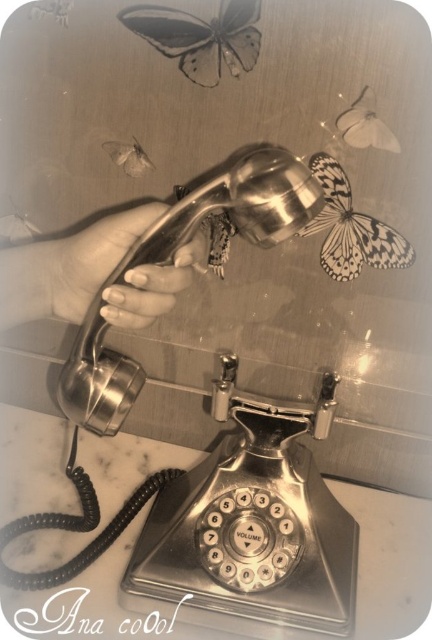
You are an artist trying to paint the scene. You want to ensure the butterflies are positioned correctly. Which butterfly, the white matte butterfly at upper right or the white paper butterfly at upper left, should you paint in front of the other?

The white matte butterfly at upper right should be painted in front of the white paper butterfly at upper left because it is closer to the viewer.

You are an interior designer arranging decorations on a wall. You have two butterflies to place, the translucent paper butterfly at upper center and the white matte butterfly at upper right. According to the scene, which butterfly should be placed to the left of the other?

The translucent paper butterfly at upper center should be placed to the left of the white matte butterfly at upper right because the description states it is positioned to the left of the latter.